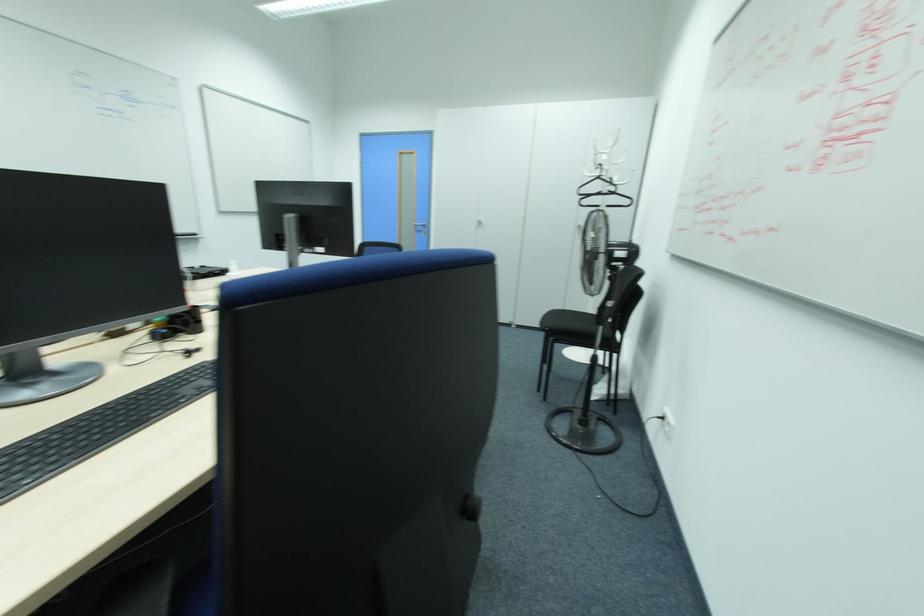
Find the location of a particular element. white coat hook is located at coordinates (602, 179).